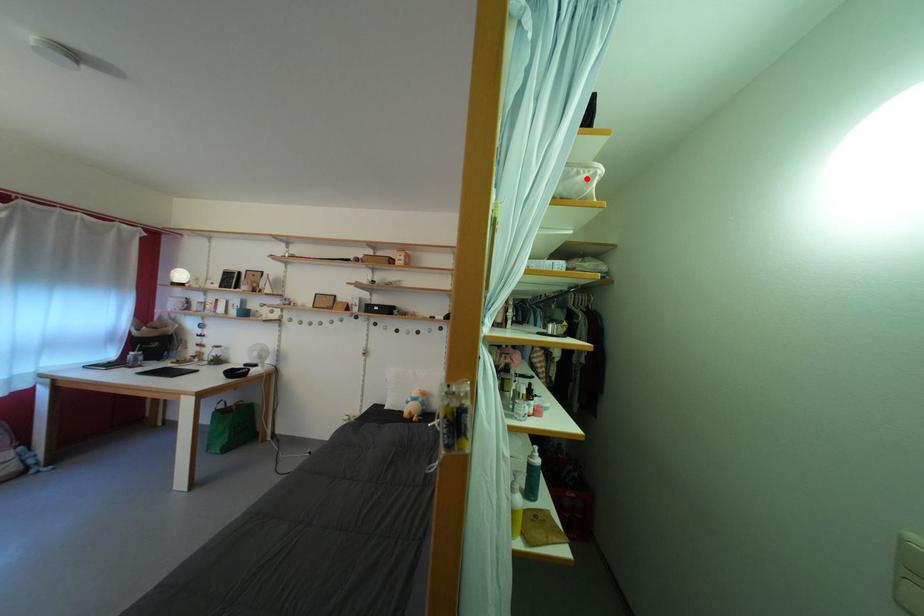
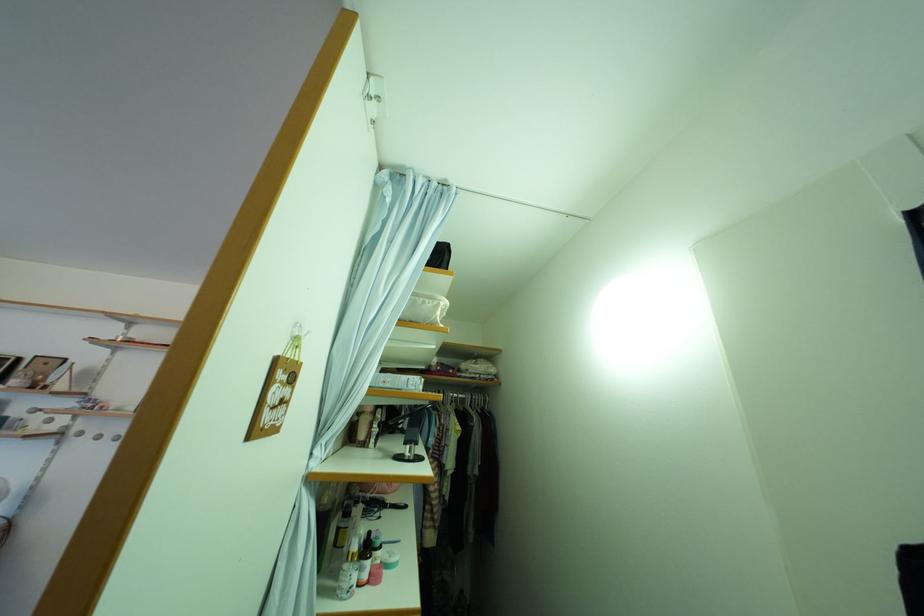
In the second image, find the point that corresponds to the highlighted location in the first image.

(432, 309)